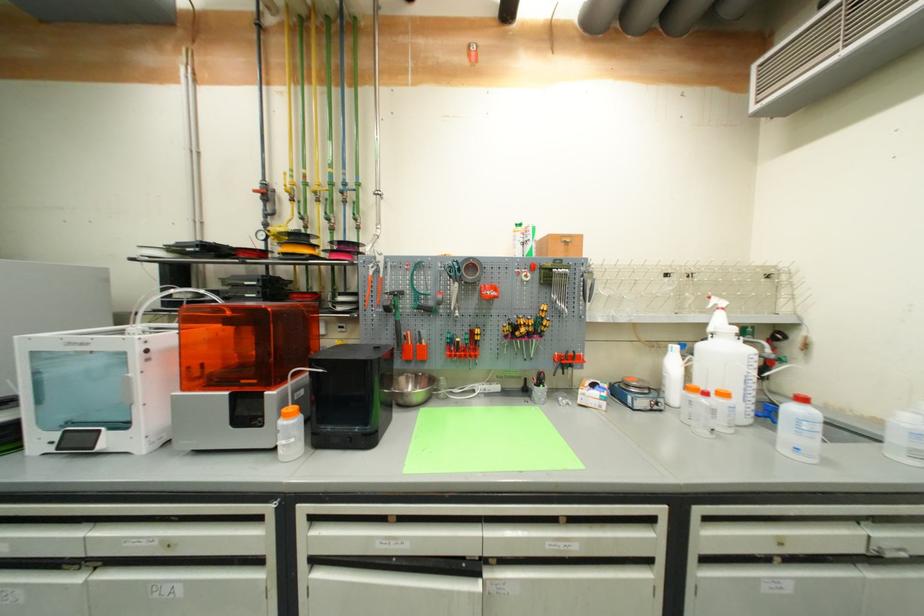
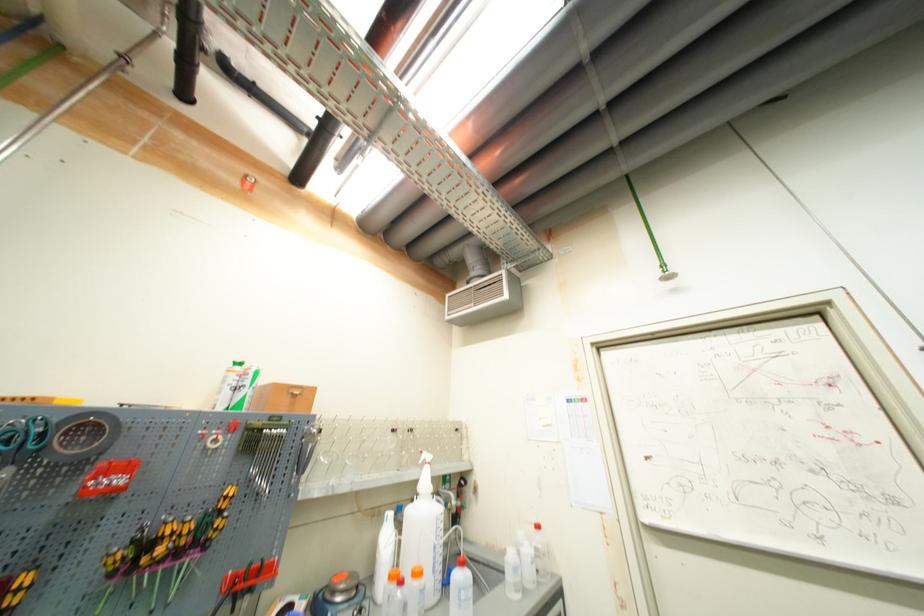
In the second image, find the point that corresponds to (456,274) in the first image.

(14, 445)